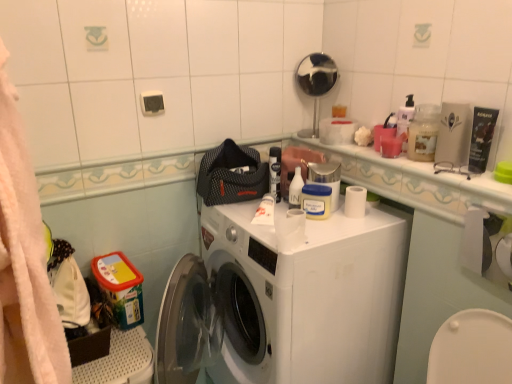
Where is `vacant space in front of translucent plastic container at upper right`? The image size is (512, 384). vacant space in front of translucent plastic container at upper right is located at coordinates (444, 172).